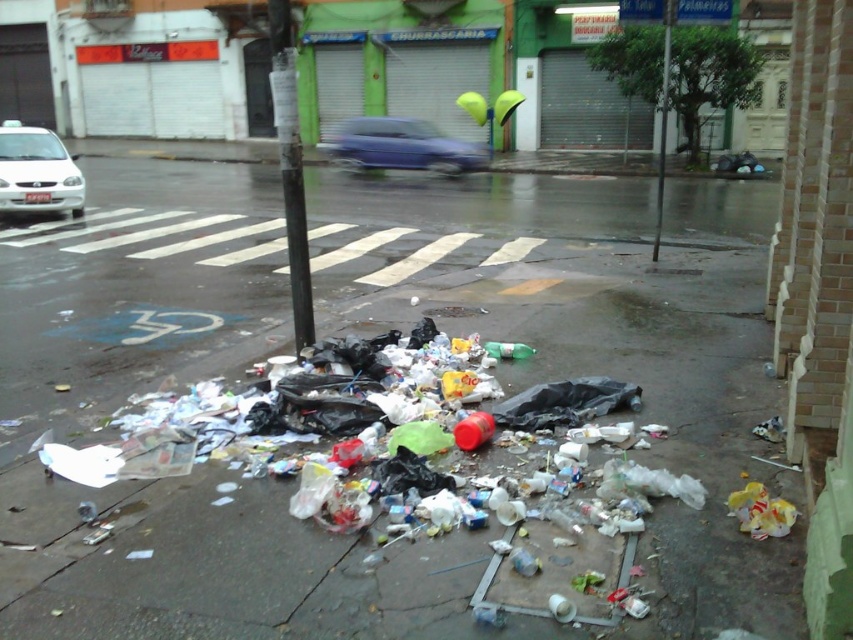
Question: Does shiny plastic trash at center have a larger size compared to black metal pole at center?

Choices:
 (A) yes
 (B) no

Answer: (B)

Question: Is black metal pole at center to the right of blue glossy car at center from the viewer's perspective?

Choices:
 (A) no
 (B) yes

Answer: (A)

Question: Does black metal pole at center have a greater width compared to metallic pole at center?

Choices:
 (A) yes
 (B) no

Answer: (B)

Question: Which object is the farthest from the metallic pole at center?

Choices:
 (A) black metal pole at center
 (B) shiny plastic trash at center
 (C) blue glossy car at center
 (D) white matte car at left

Answer: (D)

Question: Which of the following is the farthest from the observer?

Choices:
 (A) (48, 400)
 (B) (61, 141)

Answer: (B)

Question: Among these points, which one is nearest to the camera?

Choices:
 (A) (126, 273)
 (B) (445, 170)
 (C) (84, 195)

Answer: (A)